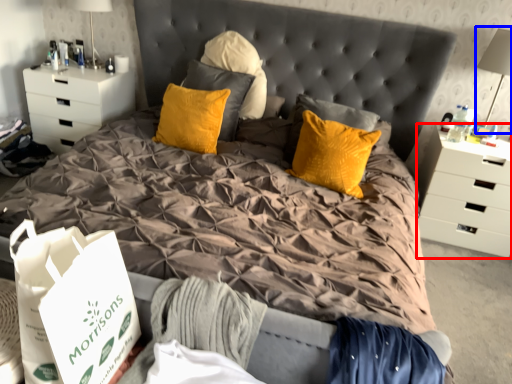
Question: Which of the following is the farthest to the observer, chest of drawers (highlighted by a red box) or table lamp (highlighted by a blue box)?

Choices:
 (A) chest of drawers
 (B) table lamp

Answer: (A)